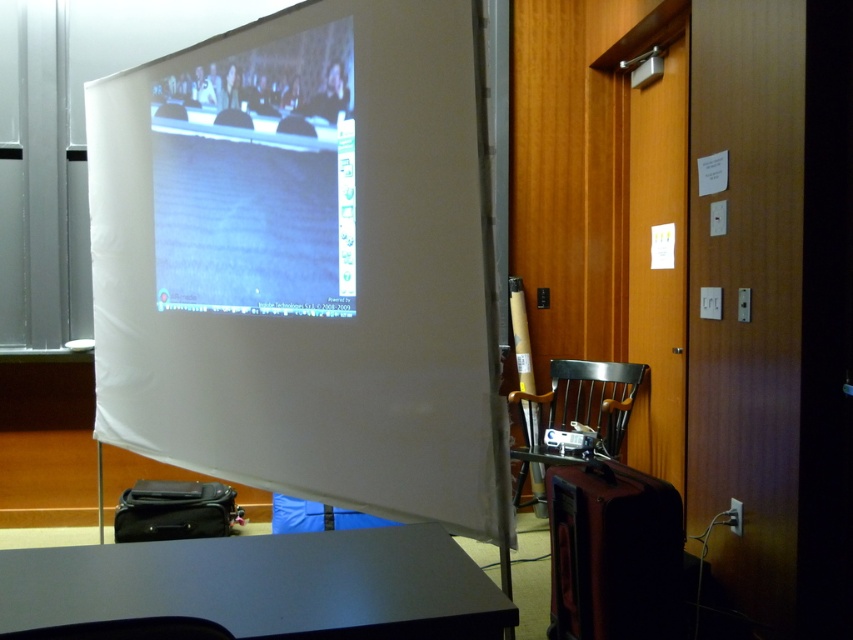
You are a presenter who needs to adjust the position of your laptop, which is currently on the wooden chair at lower right. To ensure the projection on the white matte projection screen at center is visible to all attendees, should you move the laptop closer to or farther away from the screen?

The white matte projection screen at center is in front of the wooden chair at lower right, so moving the laptop closer to the screen would place it behind the screen, obstructing the view. Therefore, you should move the laptop farther away from the screen to maintain visibility for all attendees.